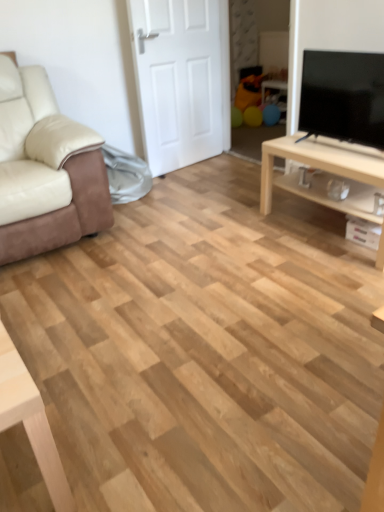
Locate an element on the screen. The width and height of the screenshot is (384, 512). unoccupied area in front of white matte door at center is located at coordinates (200, 179).